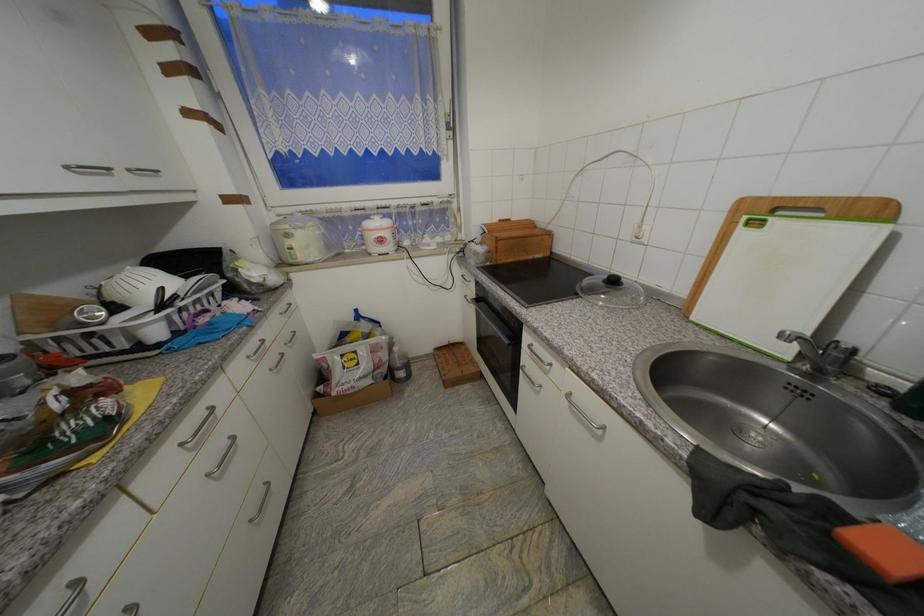
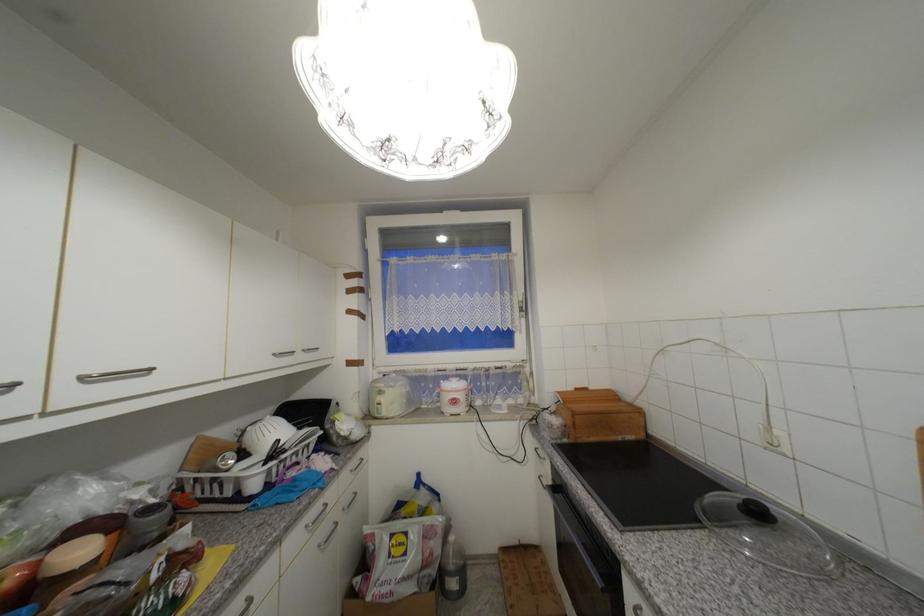
Find the pixel in the second image that matches point 619,283 in the first image.

(763, 514)